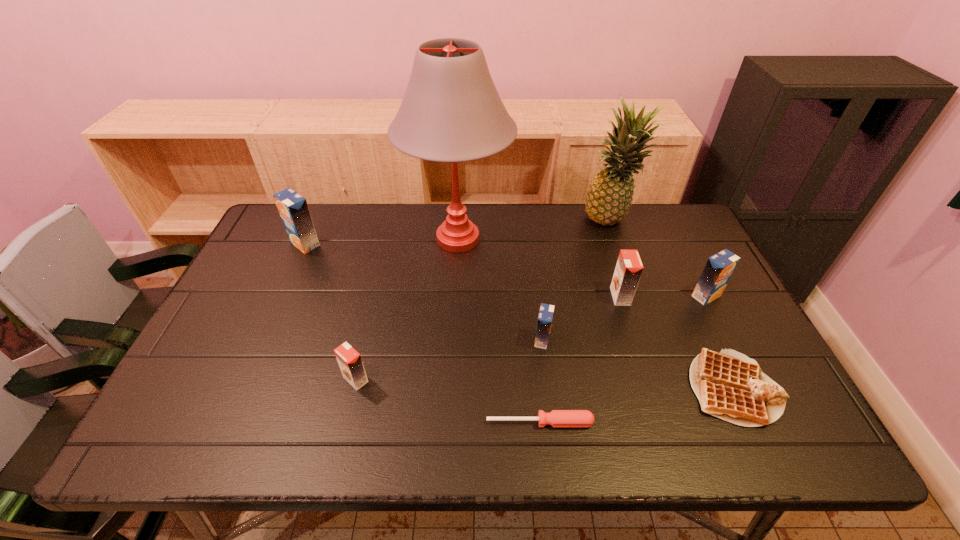
Find the location of a particular element. The height and width of the screenshot is (540, 960). free space between the smaller orange orange juice and the leftmost blue orange_juice is located at coordinates (330, 312).

Select which object is the second closest to the pineapple. Please provide its 2D coordinates. Your answer should be formatted as a tuple, i.e. [(x, y)], where the tuple contains the x and y coordinates of a point satisfying the conditions above.

[(719, 268)]

Locate which object ranks second in proximity to the pineapple. Please provide its 2D coordinates. Your answer should be formatted as a tuple, i.e. [(x, y)], where the tuple contains the x and y coordinates of a point satisfying the conditions above.

[(719, 268)]

You are a GUI agent. You are given a task and a screenshot of the screen. Output one action in this format:
    pyautogui.click(x=<x>, y=<y>)
    Task: Click on the orange juice that is the fifth nearest to the screwdriver
    This screenshot has height=540, width=960.
    Given the screenshot: What is the action you would take?
    tap(293, 209)

Locate which orange juice ranks fourth in proximity to the eighth tallest object. Please provide its 2D coordinates. Your answer should be formatted as a tuple, i.e. [(x, y)], where the tuple contains the x and y coordinates of a point satisfying the conditions above.

[(349, 360)]

Find the location of a particular element. This screenshot has width=960, height=540. the third closest blue orange_juice to the bigger orange orange juice is located at coordinates (293, 209).

Identify which blue orange_juice is the closest to the third orange juice from left to right. Please provide its 2D coordinates. Your answer should be formatted as a tuple, i.e. [(x, y)], where the tuple contains the x and y coordinates of a point satisfying the conditions above.

[(719, 268)]

Where is `vacant region that satisfies the following two spatial constraints: 1. on the front-facing side of the right orange orange juice; 2. on the right side of the tallest object`? Image resolution: width=960 pixels, height=540 pixels. vacant region that satisfies the following two spatial constraints: 1. on the front-facing side of the right orange orange juice; 2. on the right side of the tallest object is located at coordinates (454, 296).

Locate an element on the screen. This screenshot has width=960, height=540. vacant space that satisfies the following two spatial constraints: 1. on the front-facing side of the shortest object; 2. on the right side of the table lamp is located at coordinates (447, 422).

Find the location of `free spot that satisfies the following two spatial constraints: 1. on the back side of the green pineapple; 2. on the right side of the red screwdriver`. free spot that satisfies the following two spatial constraints: 1. on the back side of the green pineapple; 2. on the right side of the red screwdriver is located at coordinates (518, 221).